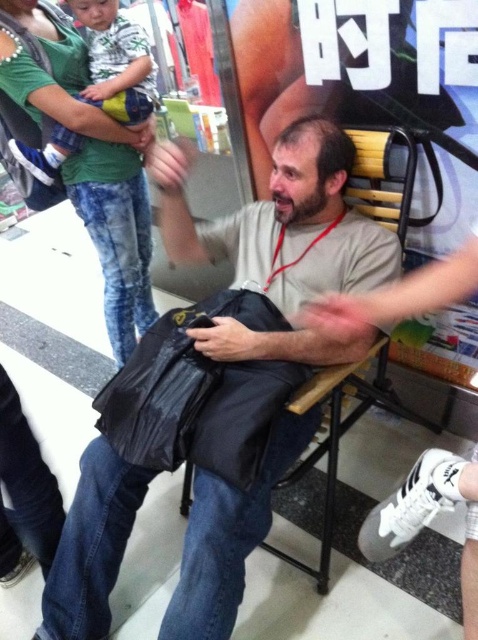
Does matte black bag at center appear on the right side of black matte bag at center?

Correct, you'll find matte black bag at center to the right of black matte bag at center.

Does point (295, 240) lie behind point (270, 314)?

Yes, point (295, 240) is behind point (270, 314).

Is point (112, 452) positioned behind point (308, 369)?

That is True.

Where is `matte black bag at center`? matte black bag at center is located at coordinates (282, 221).